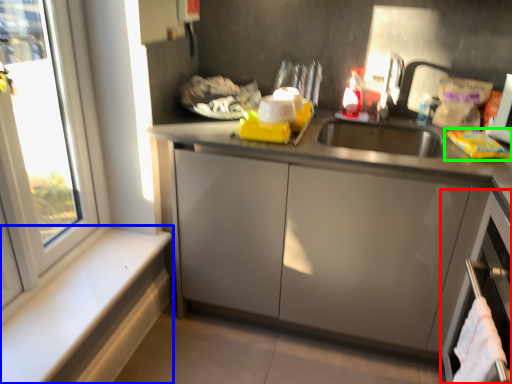
Question: Which object is the closest to the dish washer (highlighted by a red box)? Choose among these: window sill (highlighted by a blue box) or food (highlighted by a green box).

Choices:
 (A) window sill
 (B) food

Answer: (B)